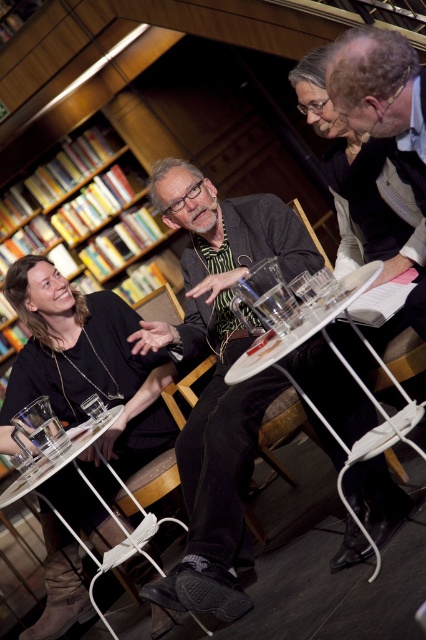
You are a visitor in the library and want to take a photo of the wooden bookcase at upper left and the clear glass table at lower left. Which object should you focus on first if you want to capture both in one frame without moving the camera?

You should focus on the clear glass table at lower left first because the wooden bookcase at upper left is much taller, so it will occupy more of the upper part of the frame, while the clear glass table at lower left is lower and smaller, making it easier to include both in the same shot by centering the composition between them.

Based on the scene described, which object occupies more visual space in the image? Please consider the sizes of the matte black shirt at lower left and the wooden bookcase at upper left.

The matte black shirt at lower left is larger in size than the wooden bookcase at upper left, so it occupies more visual space in the image.

You are standing at the entrance of the library and see the matte black shirt at lower left and the wooden bookcase at upper left. Which object is closer to you?

The matte black shirt at lower left is closer to you because it is in front of the wooden bookcase at upper left.